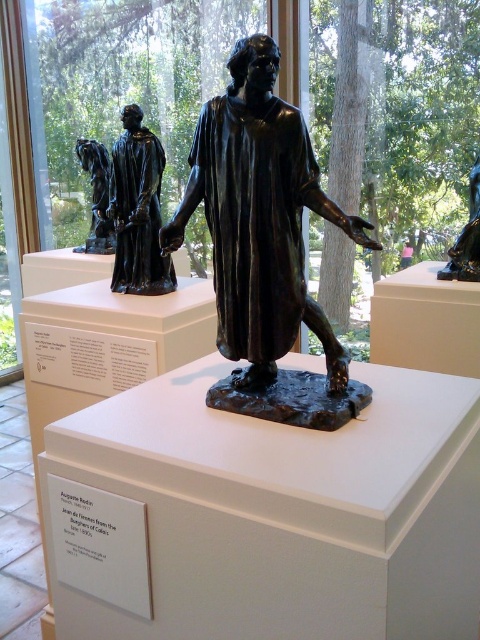
Based on the photo, who is taller, shiny bronze statue at center or shiny bronze statue at upper right?

Standing taller between the two is shiny bronze statue at center.

Does shiny bronze statue at center appear under shiny bronze statue at upper right?

Correct, shiny bronze statue at center is located below shiny bronze statue at upper right.

Does point (257, 276) come in front of point (451, 269)?

Yes, point (257, 276) is closer to viewer.

Locate an element on the screen. The width and height of the screenshot is (480, 640). shiny bronze statue at center is located at coordinates (264, 243).

Does shiny bronze statue at center have a lesser height compared to bronze statue at left?

No, shiny bronze statue at center is not shorter than bronze statue at left.

Can you confirm if shiny bronze statue at center is positioned below bronze statue at left?

Yes.

Is point (236, 378) less distant than point (108, 176)?

Yes.

Where is `shiny bronze statue at center`? shiny bronze statue at center is located at coordinates (264, 243).

Identify the location of shiny bronze statue at left. (137, 209).

Is shiny bronze statue at left smaller than shiny bronze statue at upper right?

Yes.

Is point (155, 186) positioned after point (477, 195)?

No, (155, 186) is closer to viewer.

What are the coordinates of `shiny bronze statue at left` in the screenshot? It's located at (137, 209).